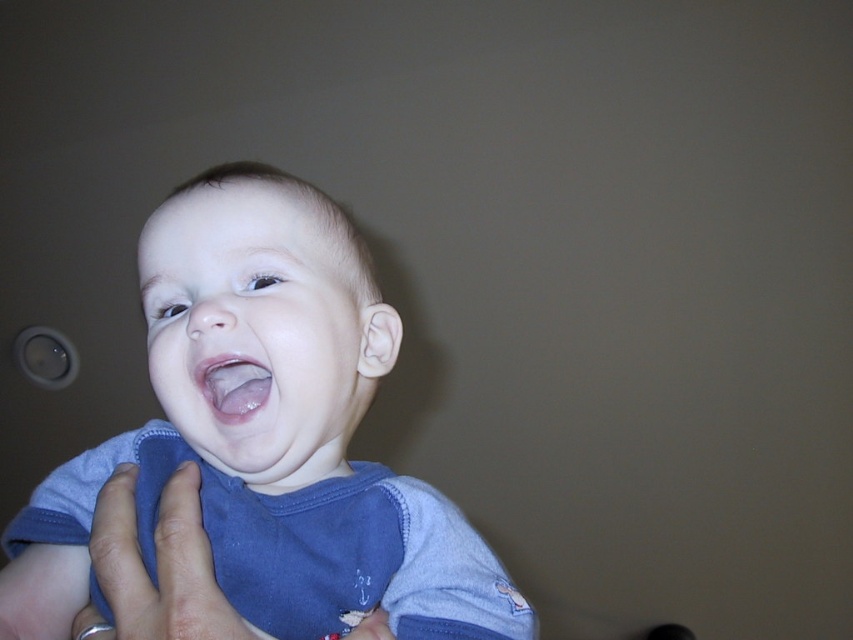
Question: Can you confirm if blue soft fabric baby at center is positioned below pink glossy lips at center?

Choices:
 (A) no
 (B) yes

Answer: (B)

Question: Is blue soft fabric baby at center bigger than pink glossy lips at center?

Choices:
 (A) yes
 (B) no

Answer: (A)

Question: Which point appears farthest from the camera in this image?

Choices:
 (A) (231, 369)
 (B) (294, 198)

Answer: (B)

Question: Does skin/softhand at center appear over pink glossy lips at center?

Choices:
 (A) no
 (B) yes

Answer: (A)

Question: Among these objects, which one is nearest to the camera?

Choices:
 (A) blue soft fabric baby at center
 (B) skin/softhand at center

Answer: (B)

Question: Estimate the real-world distances between objects in this image. Which object is closer to the skin/softhand at center?

Choices:
 (A) blue soft fabric baby at center
 (B) pink glossy lips at center

Answer: (A)